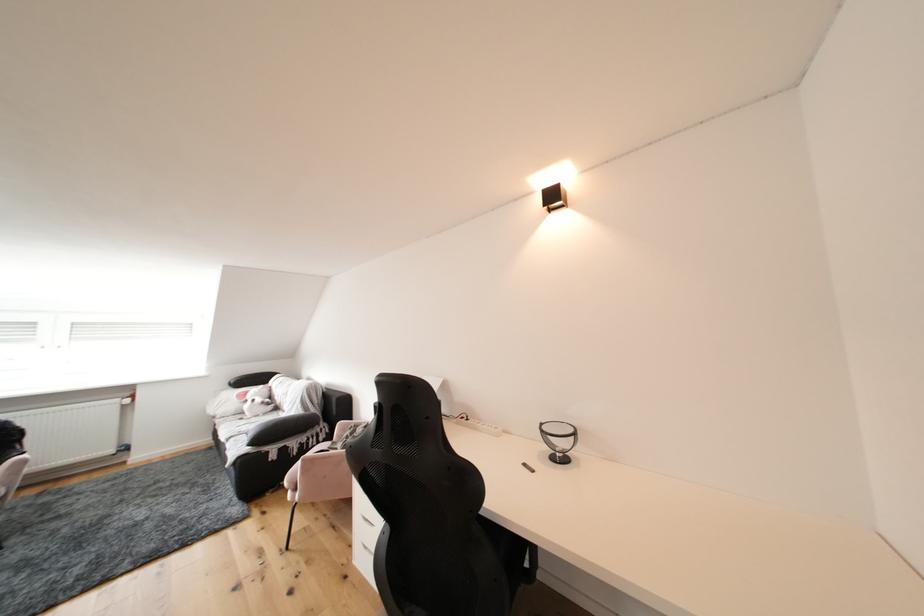
Locate an element on the screen. This screenshot has width=924, height=616. pink chair sitting surface is located at coordinates (322, 461).